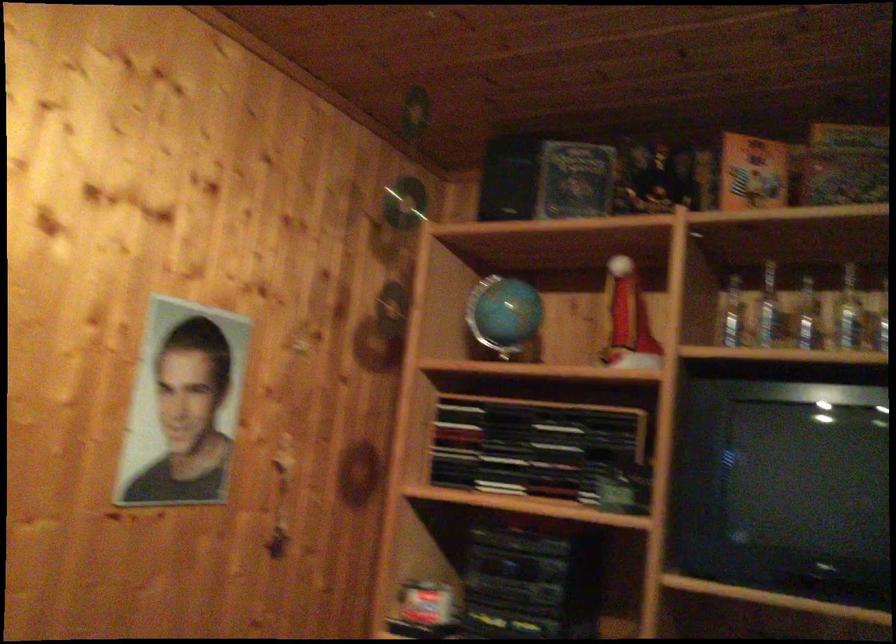
Describe the element at coordinates (504, 314) in the screenshot. This screenshot has height=644, width=896. I see `the blue desk globe` at that location.